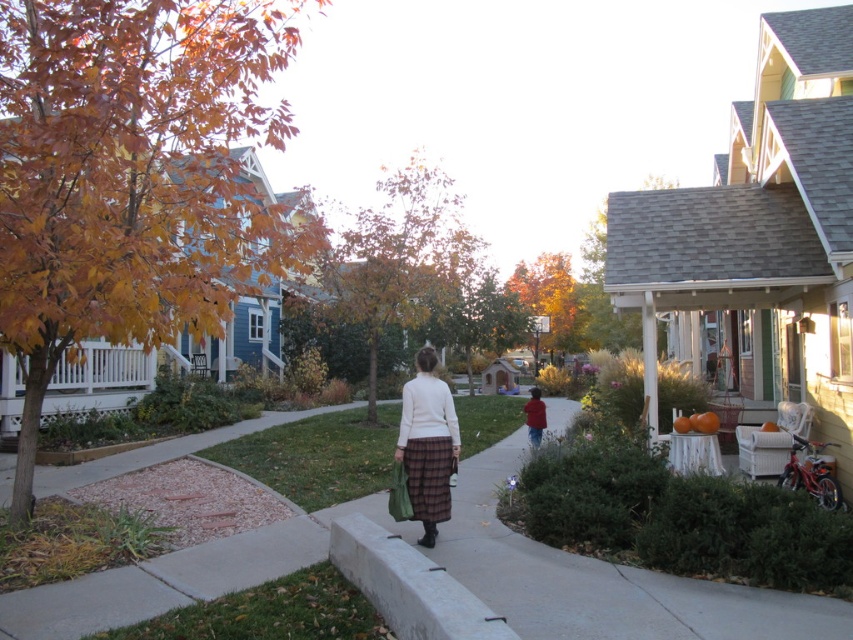
In the suburban autumn scene, you notice the white concrete curb at lower center and the white wool sweater at center. Which object takes up more space in the image?

The white concrete curb at lower center is larger in size than the white wool sweater at center, so it takes up more space in the image.